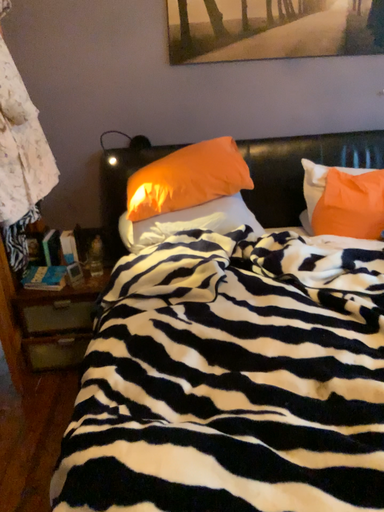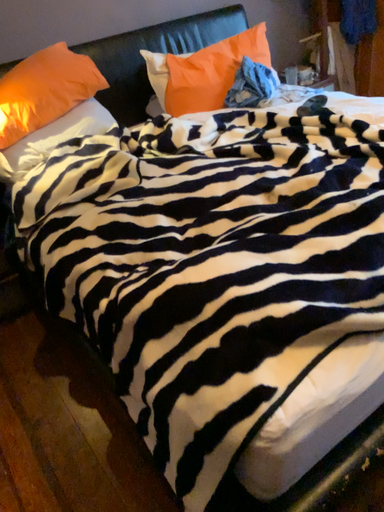
Question: How did the camera likely rotate when shooting the video?

Choices:
 (A) rotated right
 (B) rotated left

Answer: (A)